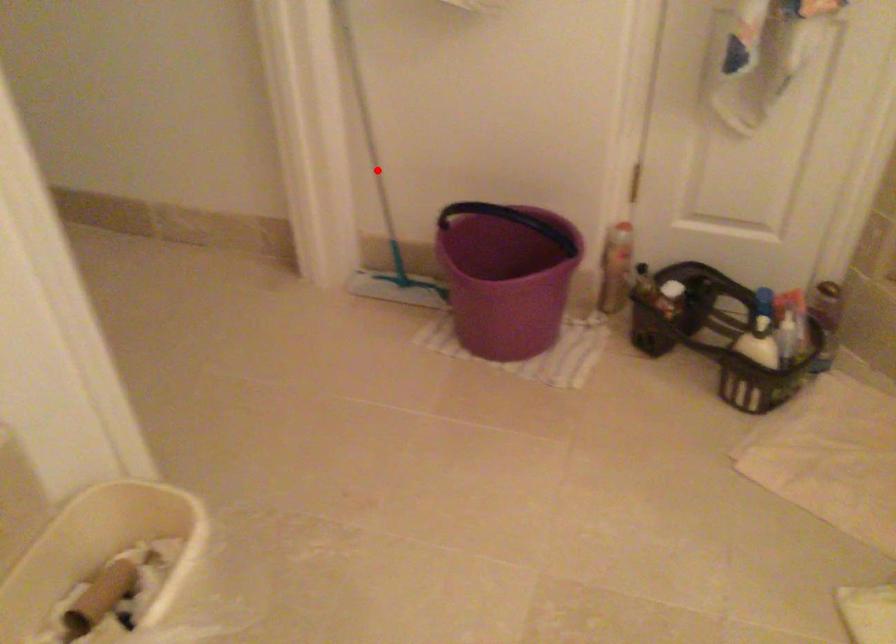
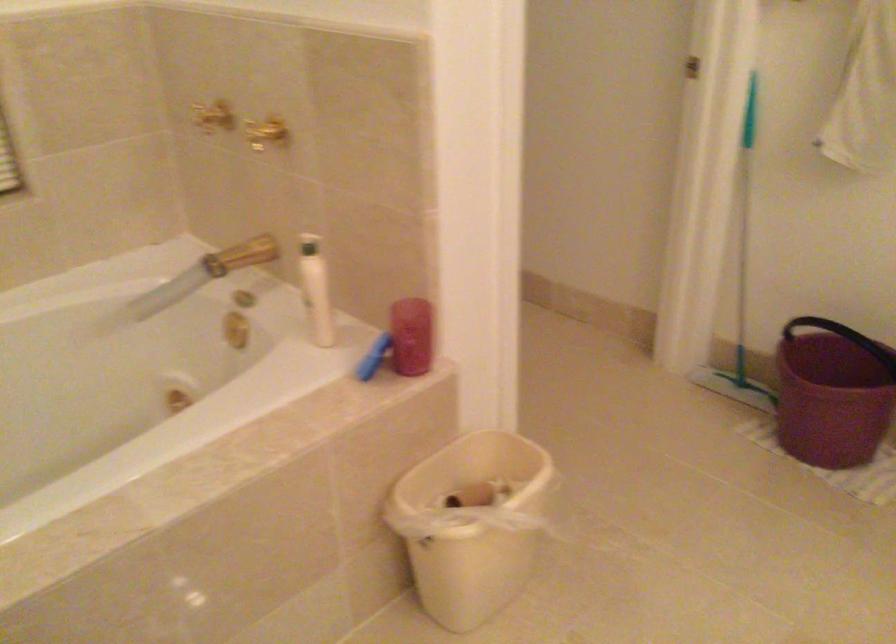
Question: I am providing you with two images of the same scene from different viewpoints. In image1, a red point is highlighted. Considering the same 3D point in image2, which of the following is correct?

Choices:
 (A) It is closer
 (B) It is farther

Answer: (B)